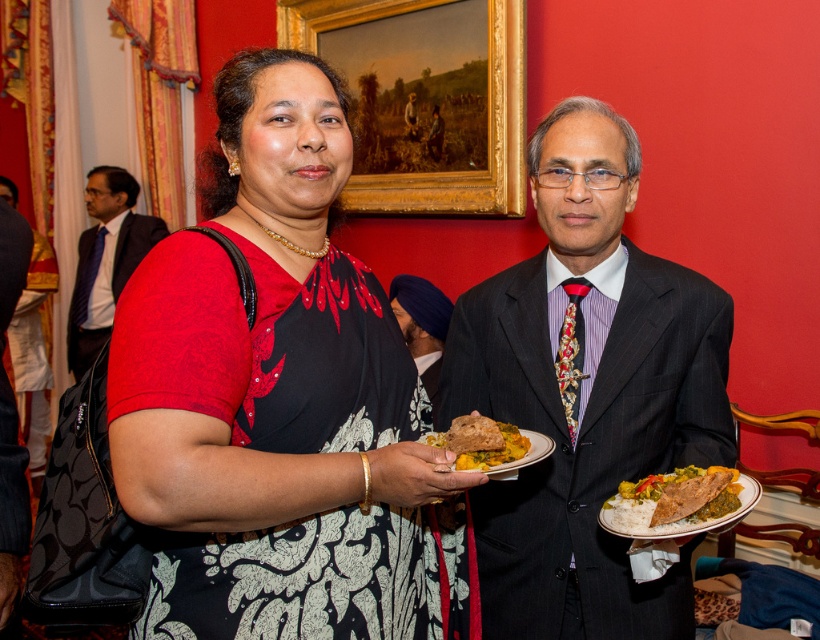
You are a guest at this event and want to reach for the food. Which item is taller between the white rice with curry and bread at center and the golden brown bread at center?

The white rice with curry and bread at center is much taller than the golden brown bread at center.

Based on the photo, you are a photographer at the event and want to ensure both the matte black dress at center and the golden brown bread at center are clearly visible in your photo. Given their sizes, which object should you focus on first to ensure proper framing?

The matte black dress at center is larger in size than the golden brown bread at center, so focusing on the matte black dress at center first will help ensure proper framing as it occupies more space in the composition.